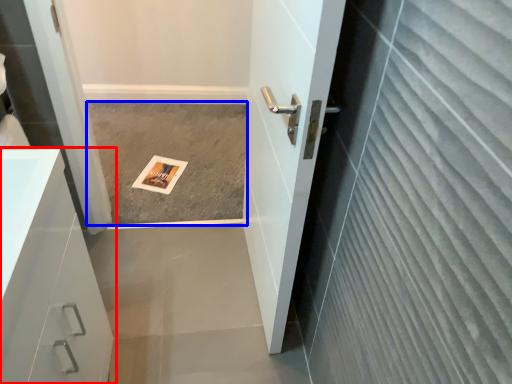
Question: Among these objects, which one is farthest to the camera, bathroom cabinet (highlighted by a red box) or concrete (highlighted by a blue box)?

Choices:
 (A) bathroom cabinet
 (B) concrete

Answer: (B)